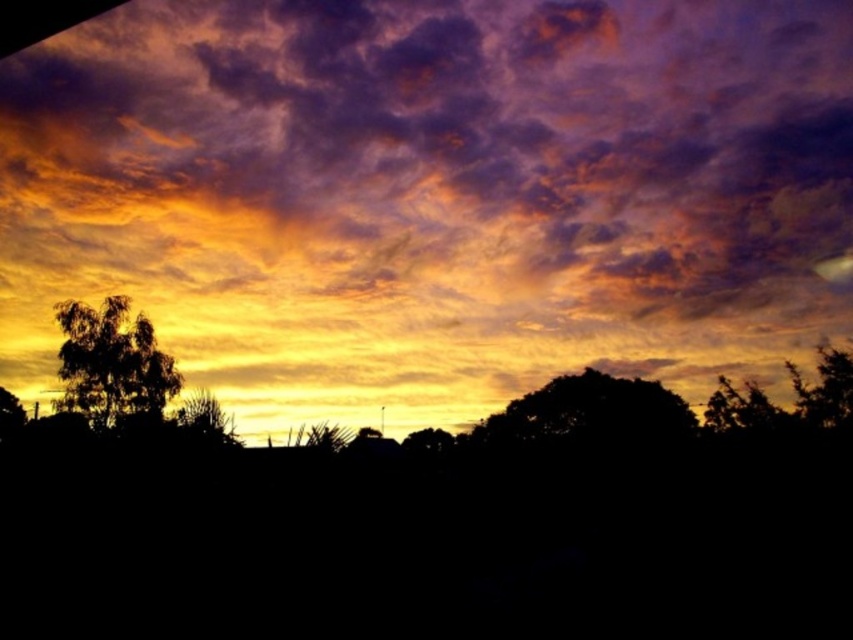
Is purple cloud at upper center smaller than green leafy tree at lower left?

Actually, purple cloud at upper center might be larger than green leafy tree at lower left.

You are a GUI agent. You are given a task and a screenshot of the screen. Output one action in this format:
    pyautogui.click(x=<x>, y=<y>)
    Task: Click on the purple cloud at upper center
    Image resolution: width=853 pixels, height=640 pixels.
    Given the screenshot: What is the action you would take?
    pyautogui.click(x=431, y=195)

Can you confirm if silhouette leafy tree at lower left is thinner than green leafy tree at lower left?

Yes, silhouette leafy tree at lower left is thinner than green leafy tree at lower left.

Is silhouette leafy tree at lower left bigger than green leafy tree at lower left?

No, silhouette leafy tree at lower left is not bigger than green leafy tree at lower left.

Identify the location of silhouette leafy tree at lower left. This screenshot has height=640, width=853. [x=112, y=362].

In order to click on silhouette leafy tree at lower left in this screenshot , I will do 112,362.

Which is more to the left, purple cloud at upper center or silhouette leafy tree at lower left?

From the viewer's perspective, silhouette leafy tree at lower left appears more on the left side.

Does point (161, 320) come closer to viewer compared to point (167, 392)?

No, it is behind (167, 392).

What are the coordinates of `purple cloud at upper center` in the screenshot? It's located at (431, 195).